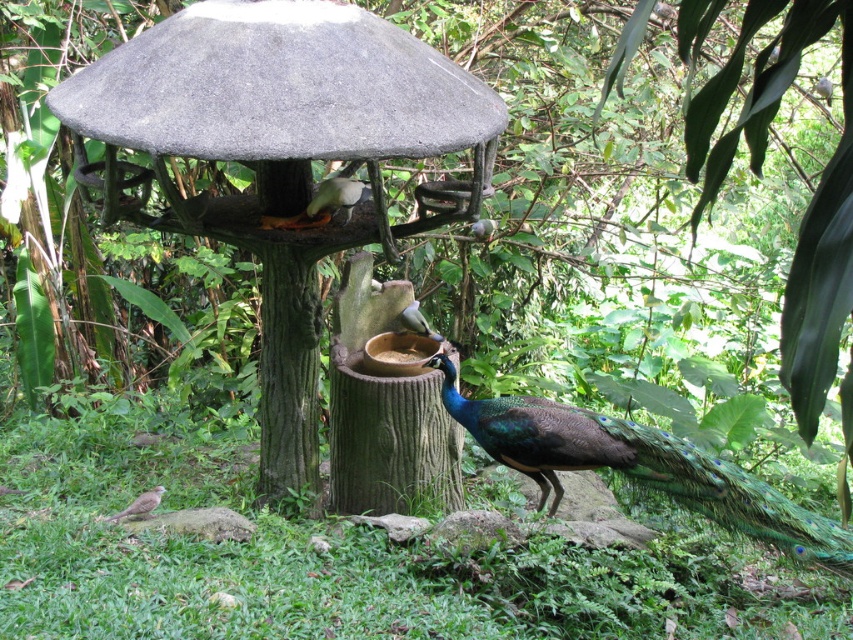
Question: Is brown speckled bird at lower left thinner than white matte bowl at center?

Choices:
 (A) no
 (B) yes

Answer: (A)

Question: Which point is closer to the camera?

Choices:
 (A) (323, 180)
 (B) (751, 483)

Answer: (B)

Question: Which of the following is the farthest from the observer?

Choices:
 (A) green glossy peacock at lower right
 (B) brown speckled bird at lower left

Answer: (B)

Question: Does white glossy bird at upper center appear under brown speckled bird at lower left?

Choices:
 (A) yes
 (B) no

Answer: (B)

Question: Which point is closer to the camera taking this photo?

Choices:
 (A) (518, 429)
 (B) (337, 192)

Answer: (B)

Question: Can you confirm if green glossy peacock at lower right is positioned above brown speckled bird at lower left?

Choices:
 (A) no
 (B) yes

Answer: (B)